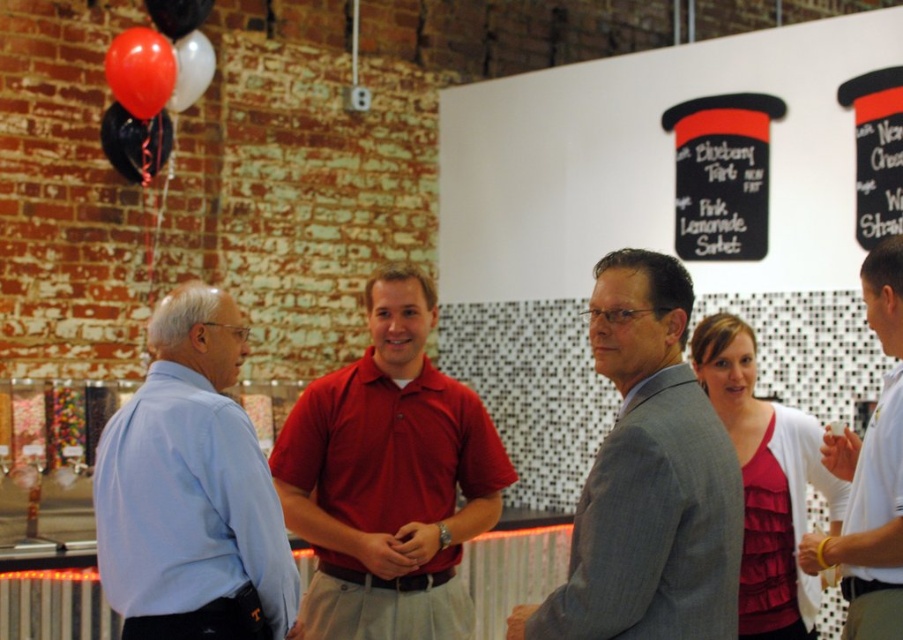
You are at a social event and notice two people wearing a matte red polo shirt at center and a light blue shirt at left. Which person has a wider shirt?

The matte red polo shirt at center is wider than the light blue shirt at left.

You are at a social event and want to find someone wearing a matte red polo shirt at center. Based on the coordinates provided, where should you look in the image?

The matte red polo shirt at center is located at point coordinates (389, 477), so you should look towards the center area slightly to the right and lower middle of the image.